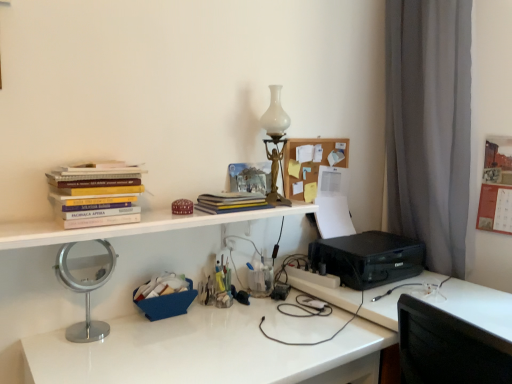
The image size is (512, 384). In order to click on free location in front of matte red box at upper center, the first stationery when ordered from top to bottom in this screenshot , I will do `click(170, 222)`.